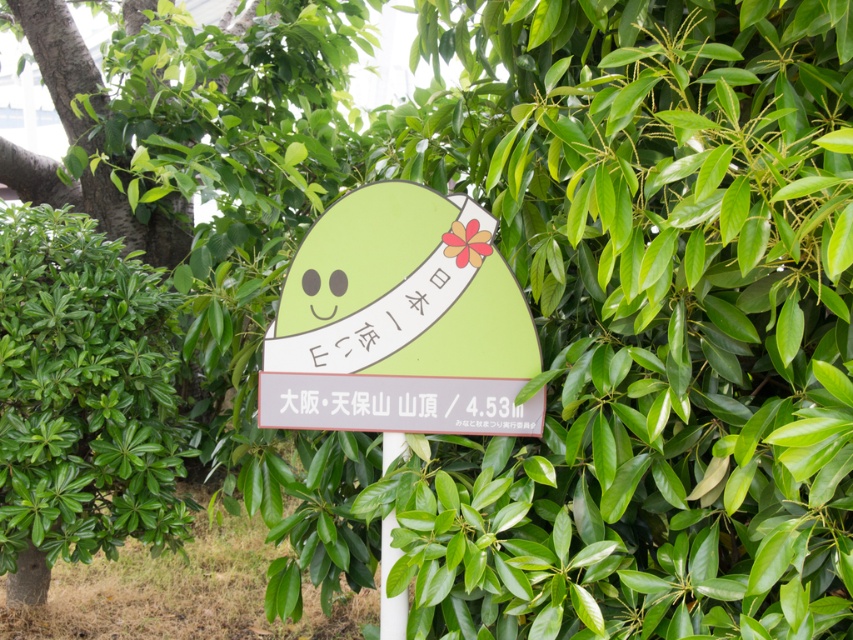
From the picture: You are a gardener who needs to trim the green leafy hedge at left and the green matte sign at center. Based on the scene, which object is positioned lower in the image?

The green leafy hedge at left is located below the green matte sign at center, so it is positioned lower in the image.

You are designing a garden layout and need to place a 2m wide statue between the green leafy hedge at left and the white plastic pole at center. Can the space between them accommodate the statue?

The green leafy hedge at left is wider than the white plastic pole at center. Since the statue requires 2m of space, you need to measure the distance between them to ensure it is at least 2 meters wide. However, the description only states the width comparison between the hedge and the pole, not the actual distance between them. Without knowing the exact spacing, it is uncertain if the statue will fit. Please check the actual distance between the two objects.

You are a hiker who just found a signboard in the forest. You notice the green matte sign at center and the white plastic pole at center. Which object would block your view more if you were standing directly in front of them?

The green matte sign at center has a larger size compared to the white plastic pole at center, so it would block your view more.